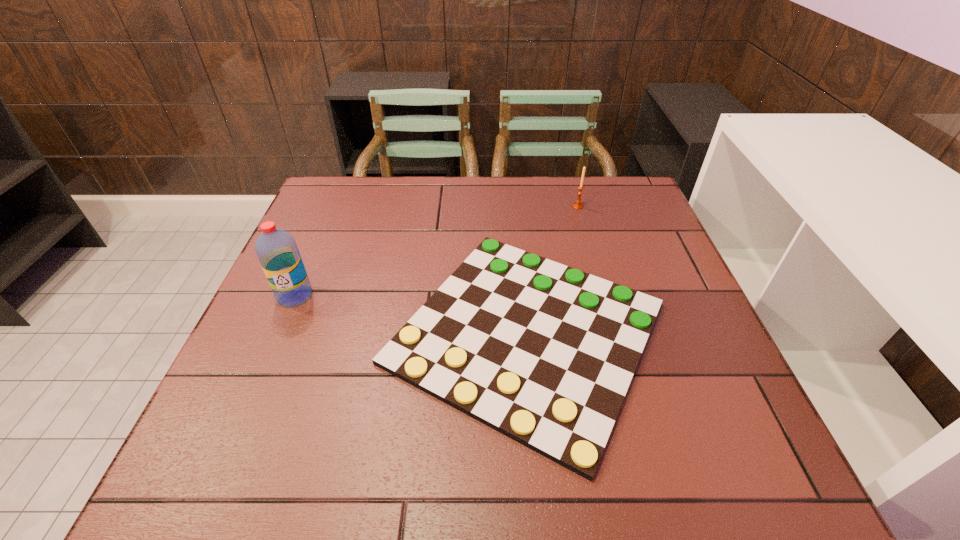
The image size is (960, 540). I want to click on vacant region that satisfies the following two spatial constraints: 1. on the front label of the shortest object; 2. on the left side of the tallest object, so click(278, 333).

Find the location of a particular element. The image size is (960, 540). vacant space that satisfies the following two spatial constraints: 1. on the front label of the shortest object; 2. on the right side of the leftmost object is located at coordinates (278, 333).